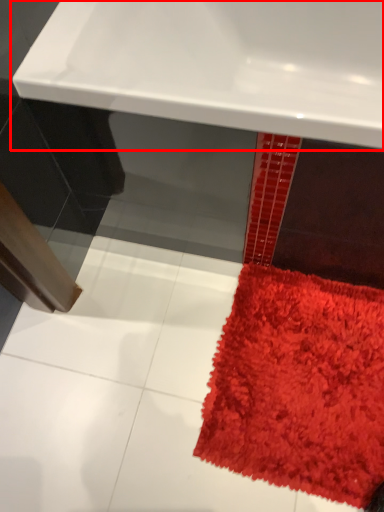
Question: From the image's perspective, where is sink (annotated by the red box) located relative to mat?

Choices:
 (A) above
 (B) below

Answer: (A)